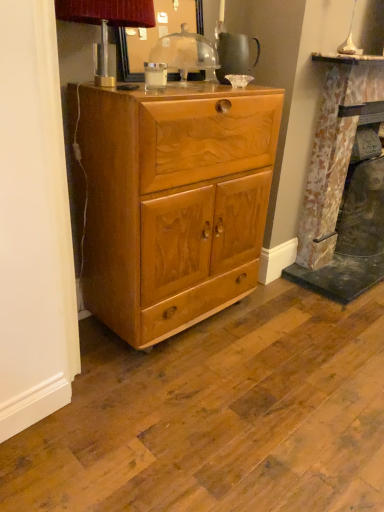
Question: Is rustic stone fireplace at right with metallic silver table lamp at upper left, placed as the first table lamp when sorted from left to right?

Choices:
 (A) no
 (B) yes

Answer: (A)

Question: Does rustic stone fireplace at right have a larger size compared to metallic silver table lamp at upper left, arranged as the second table lamp when viewed from the right?

Choices:
 (A) yes
 (B) no

Answer: (A)

Question: Does rustic stone fireplace at right have a greater width compared to metallic silver table lamp at upper left, placed as the first table lamp when sorted from left to right?

Choices:
 (A) no
 (B) yes

Answer: (B)

Question: Is rustic stone fireplace at right positioned beyond the bounds of metallic silver table lamp at upper left, arranged as the second table lamp when viewed from the right?

Choices:
 (A) yes
 (B) no

Answer: (A)

Question: Is metallic silver table lamp at upper left, arranged as the second table lamp when viewed from the right, at the back of rustic stone fireplace at right?

Choices:
 (A) yes
 (B) no

Answer: (B)

Question: Would you say metallic silver table lamp at upper left, placed as the first table lamp when sorted from left to right, is inside or outside rustic stone fireplace at right?

Choices:
 (A) outside
 (B) inside

Answer: (A)

Question: From their relative heights in the image, would you say metallic silver table lamp at upper left, placed as the first table lamp when sorted from left to right, is taller or shorter than rustic stone fireplace at right?

Choices:
 (A) short
 (B) tall

Answer: (A)

Question: Is metallic silver table lamp at upper left, placed as the first table lamp when sorted from left to right, wider or thinner than rustic stone fireplace at right?

Choices:
 (A) thin
 (B) wide

Answer: (A)

Question: Considering the positions of point (69, 8) and point (314, 289), is point (69, 8) closer or farther from the camera than point (314, 289)?

Choices:
 (A) closer
 (B) farther

Answer: (A)

Question: In the image, is rustic stone fireplace at right positioned in front of or behind metallic silver table lamp at upper left, arranged as the second table lamp when viewed from the right?

Choices:
 (A) front
 (B) behind

Answer: (B)

Question: In the image, is rustic stone fireplace at right on the left side or the right side of metallic silver table lamp at upper left, arranged as the second table lamp when viewed from the right?

Choices:
 (A) right
 (B) left

Answer: (A)

Question: Is rustic stone fireplace at right taller or shorter than metallic silver table lamp at upper left, arranged as the second table lamp when viewed from the right?

Choices:
 (A) tall
 (B) short

Answer: (A)

Question: From a real-world perspective, is rustic stone fireplace at right physically located above or below metallic silver table lamp at upper left, arranged as the second table lamp when viewed from the right?

Choices:
 (A) above
 (B) below

Answer: (B)

Question: From a real-world perspective, is light brown wood cabinet at center physically located above or below rustic stone fireplace at right?

Choices:
 (A) above
 (B) below

Answer: (B)

Question: Based on their sizes in the image, would you say light brown wood cabinet at center is bigger or smaller than rustic stone fireplace at right?

Choices:
 (A) big
 (B) small

Answer: (B)